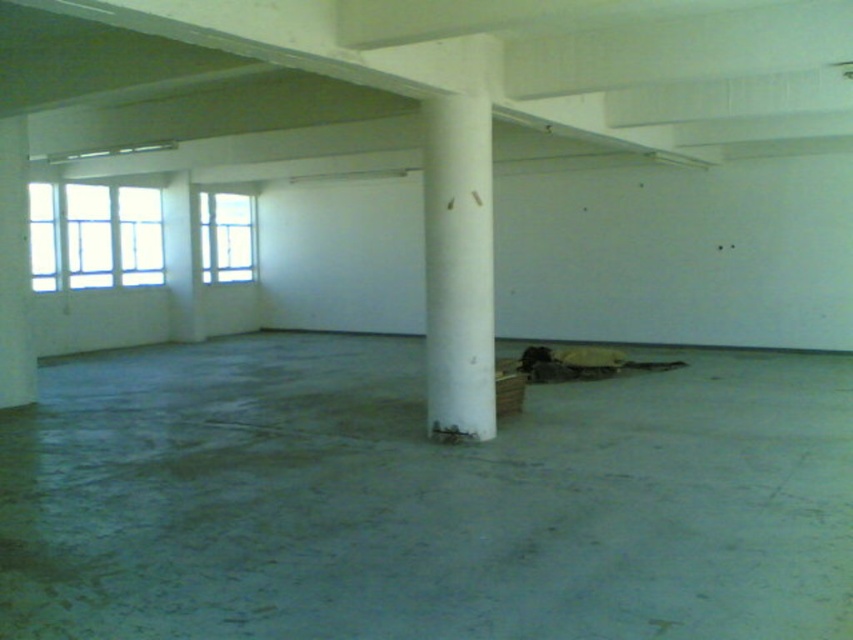
You are an interior designer planning to place a large sculpture in this room. The sculpture requires a space that is wider than the white smooth column at center and narrower than the clear glass window at upper left. Based on the room layout described, is there a suitable location to place the sculpture?

The white smooth column at center is thinner than the clear glass window at upper left, so there is a suitable width between their dimensions for placing the sculpture.

In the scene shown: You are standing at the entrance of the room and want to move towards the point labeled as point (450, 180). However, there is an obstacle at point (132, 264). Will you encounter the obstacle before reaching your destination?

Yes, you will encounter the obstacle at point (132, 264) before reaching point (450, 180) because point (450, 180) is in front of point (132, 264) according to the spatial arrangement.

You are standing in the room and want to move from the entrance door to the clear glass window at upper left. The white smooth column at center is blocking your path. Can you walk around the column to reach the window?

The white smooth column at center is closer to the viewer than clear glass window at upper left, so you can walk around the column to reach the clear glass window at upper left since it is not in front of the window but positioned closer to you.